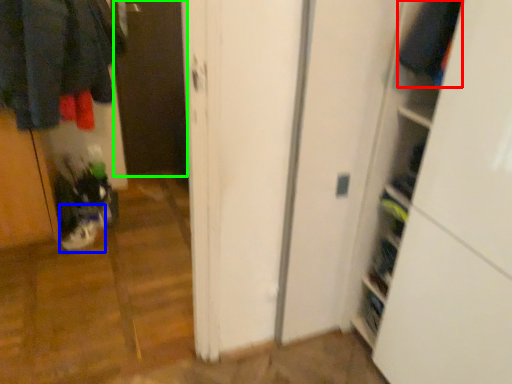
Question: Which object is positioned closest to clothing (highlighted by a red box)? Select from footwear (highlighted by a blue box) and screen door (highlighted by a green box).

Choices:
 (A) footwear
 (B) screen door

Answer: (A)